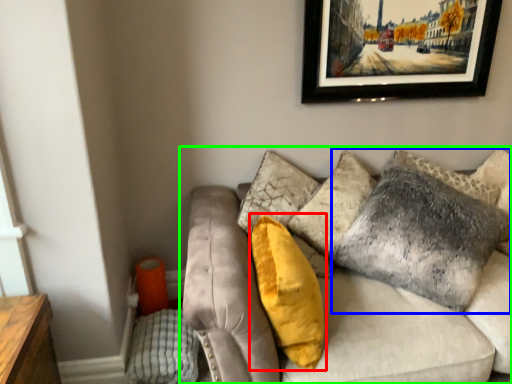
Question: Which object is positioned farthest from pillow (highlighted by a red box)? Select from pillow (highlighted by a blue box) and studio couch (highlighted by a green box).

Choices:
 (A) pillow
 (B) studio couch

Answer: (A)